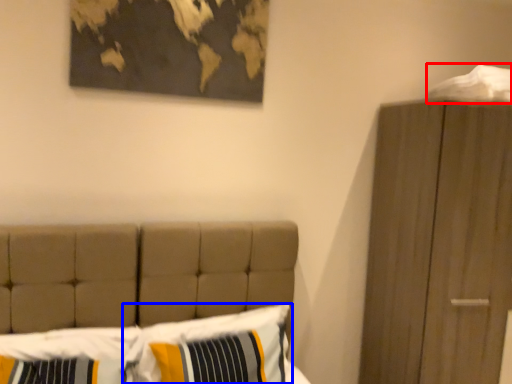
Question: Which of the following is the farthest to the observer, sheet (highlighted by a red box) or pillow (highlighted by a blue box)?

Choices:
 (A) sheet
 (B) pillow

Answer: (A)